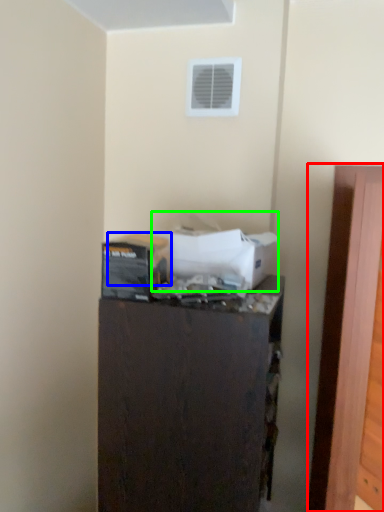
Question: Which object is positioned closest to door (highlighted by a red box)? Select from box (highlighted by a blue box) and box (highlighted by a green box).

Choices:
 (A) box
 (B) box

Answer: (B)